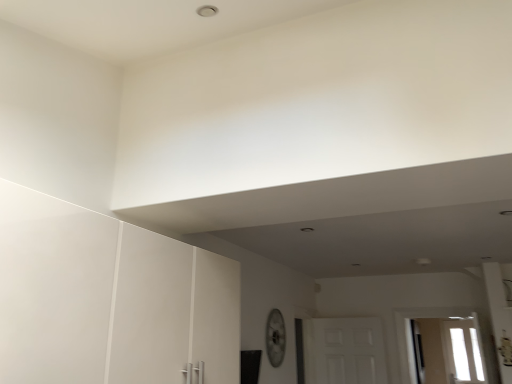
Question: From the image's perspective, relative to white matte door at center, is transparent glass window at lower right above or below?

Choices:
 (A) above
 (B) below

Answer: (B)

Question: Is transparent glass window at lower right inside or outside of white matte door at center?

Choices:
 (A) inside
 (B) outside

Answer: (B)

Question: From a real-world perspective, is transparent glass window at lower right physically located above or below white matte door at center?

Choices:
 (A) below
 (B) above

Answer: (A)

Question: Considering their positions, is white matte door at center located in front of or behind transparent glass window at lower right?

Choices:
 (A) front
 (B) behind

Answer: (A)

Question: Which is correct: white matte door at center is inside transparent glass window at lower right, or outside of it?

Choices:
 (A) inside
 (B) outside

Answer: (B)

Question: In terms of width, does white matte door at center look wider or thinner when compared to transparent glass window at lower right?

Choices:
 (A) thin
 (B) wide

Answer: (B)

Question: Would you say white matte door at center is to the left or to the right of transparent glass window at lower right in the picture?

Choices:
 (A) left
 (B) right

Answer: (A)